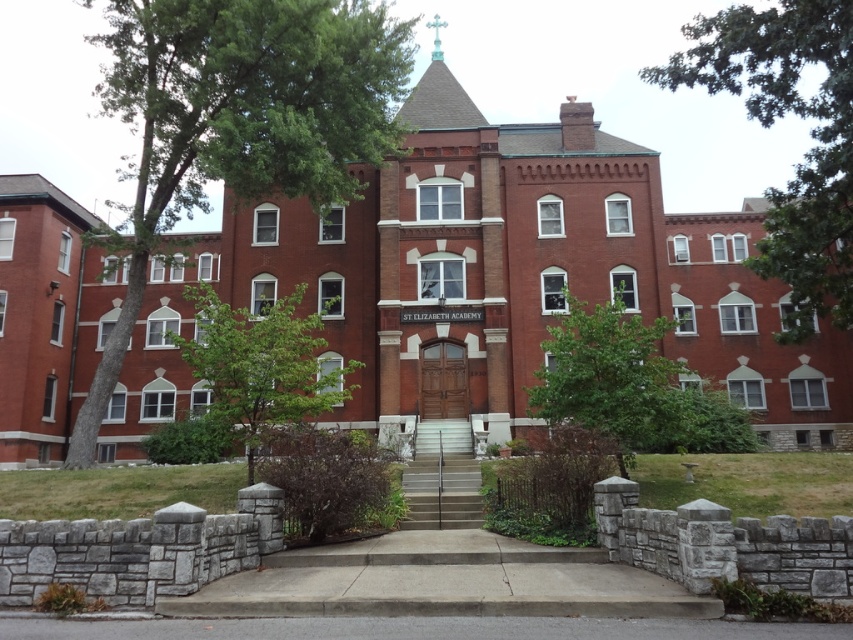
Question: Can you confirm if brick church at center is wider than green leafy tree at lower left?

Choices:
 (A) yes
 (B) no

Answer: (A)

Question: Which point is farther to the camera?

Choices:
 (A) (430, 252)
 (B) (566, 316)

Answer: (A)

Question: Where is brick church at center located in relation to green leafy tree at lower left in the image?

Choices:
 (A) right
 (B) left

Answer: (B)

Question: Does green leafy tree at left appear on the right side of green leafy tree at lower left?

Choices:
 (A) yes
 (B) no

Answer: (B)

Question: Which object appears closest to the camera in this image?

Choices:
 (A) brick church at center
 (B) green leafy tree at left
 (C) green leafy tree at center

Answer: (C)

Question: Among these points, which one is nearest to the camera?

Choices:
 (A) (204, 42)
 (B) (544, 352)

Answer: (A)